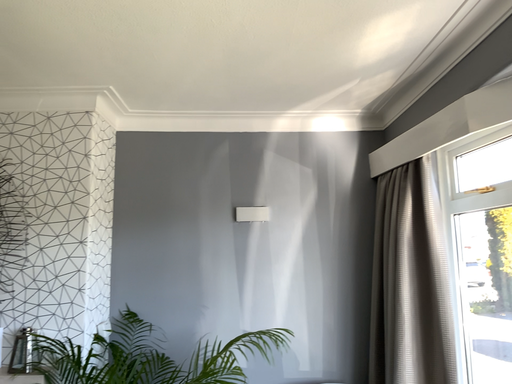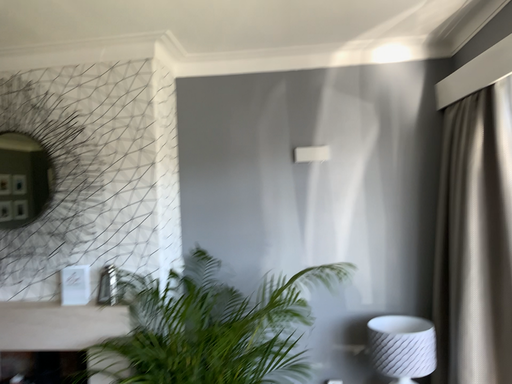
Question: How did the camera likely rotate when shooting the video?

Choices:
 (A) rotated right
 (B) rotated left

Answer: (B)